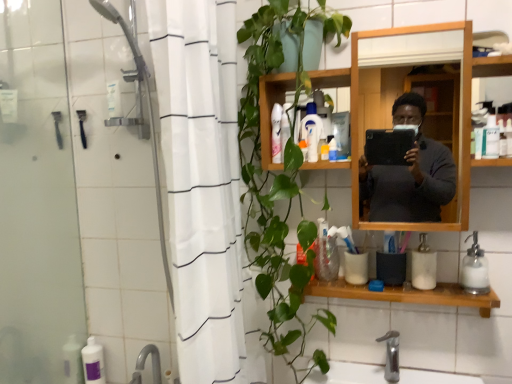
Question: Would you say wooden shelf at lower center is to the left or to the right of white plastic bottle at upper center, marked as the fifth toiletry in a left-to-right arrangement, in the picture?

Choices:
 (A) left
 (B) right

Answer: (B)

Question: From a real-world perspective, is wooden shelf at lower center above or below white plastic bottle at upper center, placed as the 6th toiletry when sorted from front to back?

Choices:
 (A) below
 (B) above

Answer: (A)

Question: Estimate the real-world distances between objects in this image. Which object is closer to the white fabric shower curtain at left?

Choices:
 (A) white marble soap dispenser at lower right, acting as the first soap dispenser starting from the left
 (B) purple matte bottle at lower left, the first toiletry in the back-to-front sequence
 (C) white plastic bottle at upper center, which is counted as the 5th toiletry, starting from the back
 (D) white plastic tube at upper center, placed as the 7th toiletry when sorted from front to back
 (E) translucent plastic bottle at center, the third toiletry in the bottom-to-top sequence

Answer: (D)

Question: Considering the real-world distances, which object is closest to the white plastic tube at upper center, which is the 7th toiletry from bottom to top?

Choices:
 (A) translucent plastic bottle at center, which is the 4th toiletry in back-to-front order
 (B) wooden shelf at lower center
 (C) white plastic bottle at upper center, which is counted as the first toiletry, starting from the top
 (D) white marble soap dispenser at lower right, the 2th soap dispenser from the right
 (E) white plastic container at upper right, which appears as the first toiletry when viewed from the right

Answer: (C)